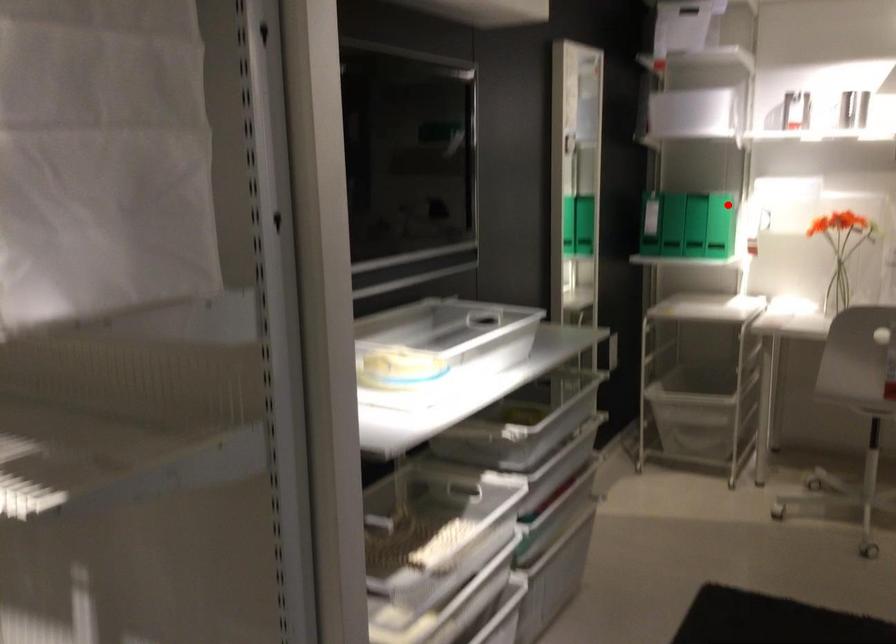
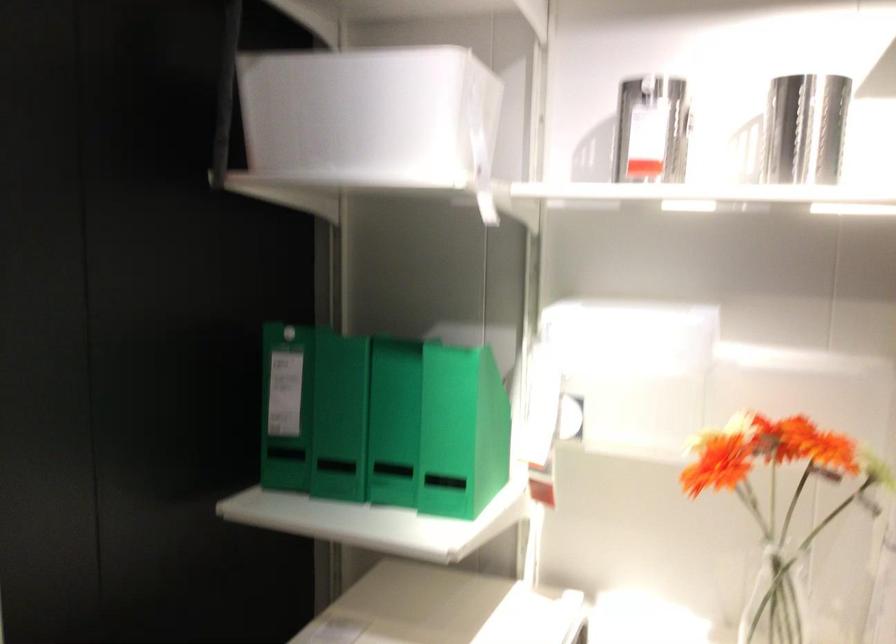
Question: I am providing you with two images of the same scene from different viewpoints. Given a red point in image1, look at the same physical point in image2. Is it:

Choices:
 (A) Closer to the viewpoint
 (B) Farther from the viewpoint

Answer: (A)